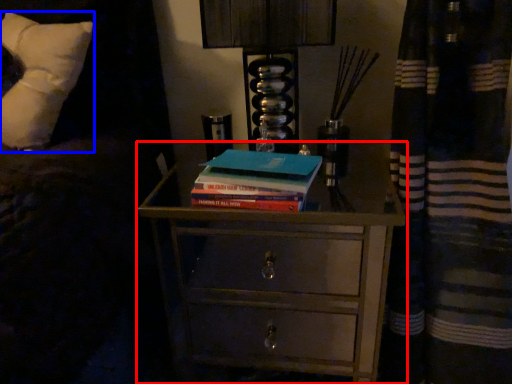
Question: Which object is closer to the camera taking this photo, chest of drawers (highlighted by a red box) or pillow (highlighted by a blue box)?

Choices:
 (A) chest of drawers
 (B) pillow

Answer: (B)